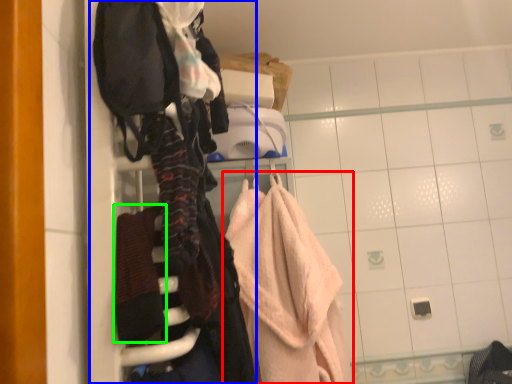
Question: Which is nearer to the towel (highlighted by a red box)? closet (highlighted by a blue box) or bath towel (highlighted by a green box).

Choices:
 (A) closet
 (B) bath towel

Answer: (A)